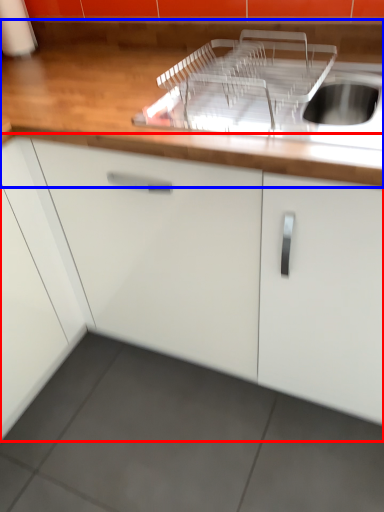
Question: Which object is further to the camera taking this photo, cabinetry (highlighted by a red box) or countertop (highlighted by a blue box)?

Choices:
 (A) cabinetry
 (B) countertop

Answer: (B)